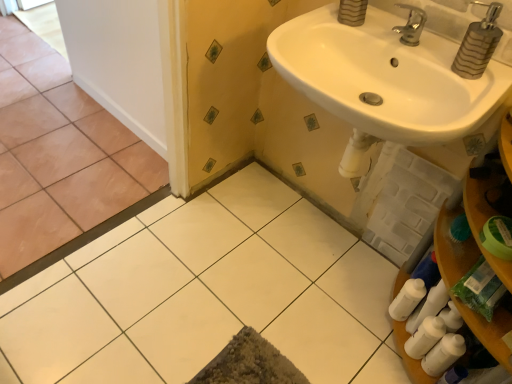
Question: From a real-world perspective, relative to white glossy sink at upper right, is white glossy tile at center, marked as the 2th ceramic tile in a left-to-right arrangement, vertically above or below?

Choices:
 (A) above
 (B) below

Answer: (B)

Question: Is white glossy tile at center, marked as the 2th ceramic tile in a left-to-right arrangement, spatially inside white glossy sink at upper right, or outside of it?

Choices:
 (A) outside
 (B) inside

Answer: (A)

Question: Estimate the real-world distances between objects in this image. Which object is farther from the white glossy sink at upper right?

Choices:
 (A) brown matte tile at left, which appears as the 1th ceramic tile when viewed from the left
 (B) silver metallic faucet at upper right
 (C) metallic striped soap dispenser at upper right
 (D) white glossy tile at center, marked as the 2th ceramic tile in a left-to-right arrangement

Answer: (A)

Question: Estimate the real-world distances between objects in this image. Which object is farther from the metallic striped soap dispenser at upper right?

Choices:
 (A) silver metallic faucet at upper right
 (B) white glossy tile at center, the 1th ceramic tile when ordered from right to left
 (C) brown matte tile at left, arranged as the second ceramic tile when viewed from the right
 (D) white glossy sink at upper right

Answer: (C)